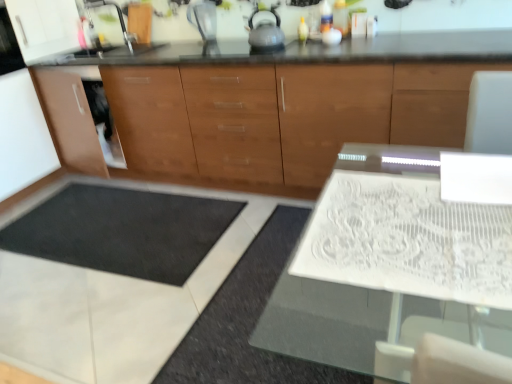
Find the location of a particular element. vacant area on top of white glass table at center (from a real-world perspective) is located at coordinates (415, 220).